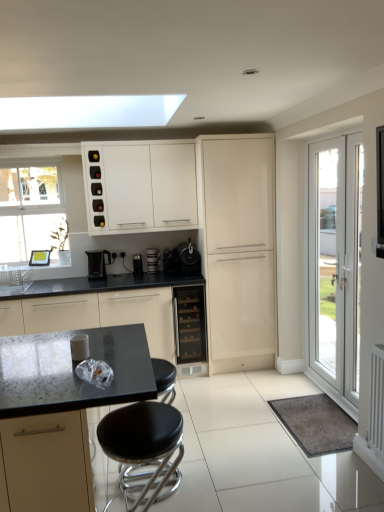
This screenshot has height=512, width=384. Identify the location of vacant space underneath black plastic kettle at center (from a real-world perspective). (107, 274).